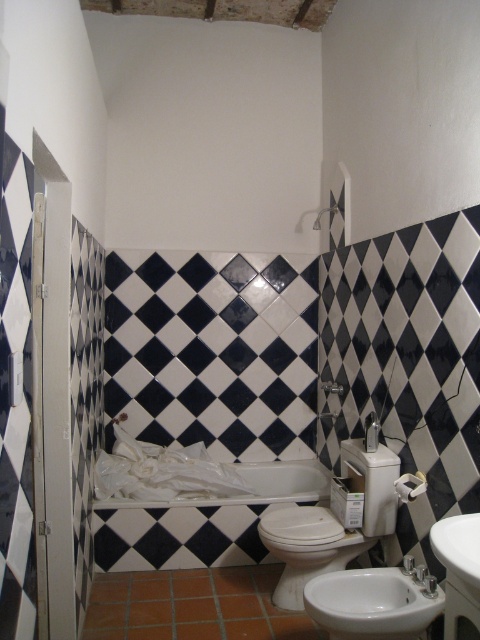
Who is shorter, white glossy bidet at lower right or white glossy toilet bowl at lower center?

white glossy bidet at lower right

Can you confirm if white glossy bidet at lower right is bigger than white glossy toilet bowl at lower center?

No.

Who is more forward, [404,582] or [334,568]?

Point [404,582]

Find the location of a particular element. The width and height of the screenshot is (480, 640). white glossy bidet at lower right is located at coordinates (371, 604).

Does white glossy toilet bowl at lower center appear under matte white shower at upper center?

Yes, white glossy toilet bowl at lower center is below matte white shower at upper center.

Based on the photo, does white glossy toilet bowl at lower center have a lesser width compared to matte white shower at upper center?

Incorrect, white glossy toilet bowl at lower center's width is not less than matte white shower at upper center's.

The height and width of the screenshot is (640, 480). What do you see at coordinates (307, 547) in the screenshot? I see `white glossy toilet bowl at lower center` at bounding box center [307, 547].

At what (x,y) coordinates should I click in order to perform the action: click on white glossy toilet bowl at lower center. Please return your answer as a coordinate pair (x, y). Looking at the image, I should click on (307, 547).

Can you confirm if white glossy bidet at lower right is smaller than white glossy sink at lower right?

No.

Looking at this image, does white glossy bidet at lower right have a greater width compared to white glossy sink at lower right?

Indeed, white glossy bidet at lower right has a greater width compared to white glossy sink at lower right.

Between point (360, 612) and point (435, 540), which one is positioned behind?

Point (360, 612)

Locate an element on the screen. white glossy bidet at lower right is located at coordinates (371, 604).